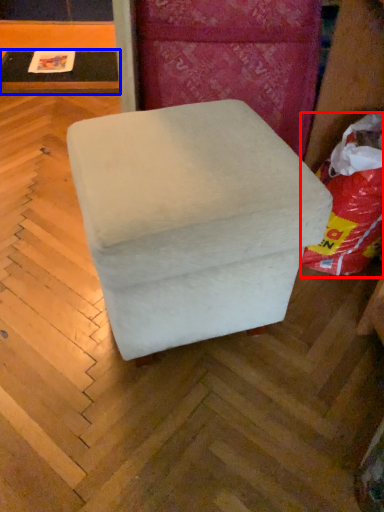
Question: Which point is further to the camera, bean bag chair (highlighted by a red box) or table (highlighted by a blue box)?

Choices:
 (A) bean bag chair
 (B) table

Answer: (B)